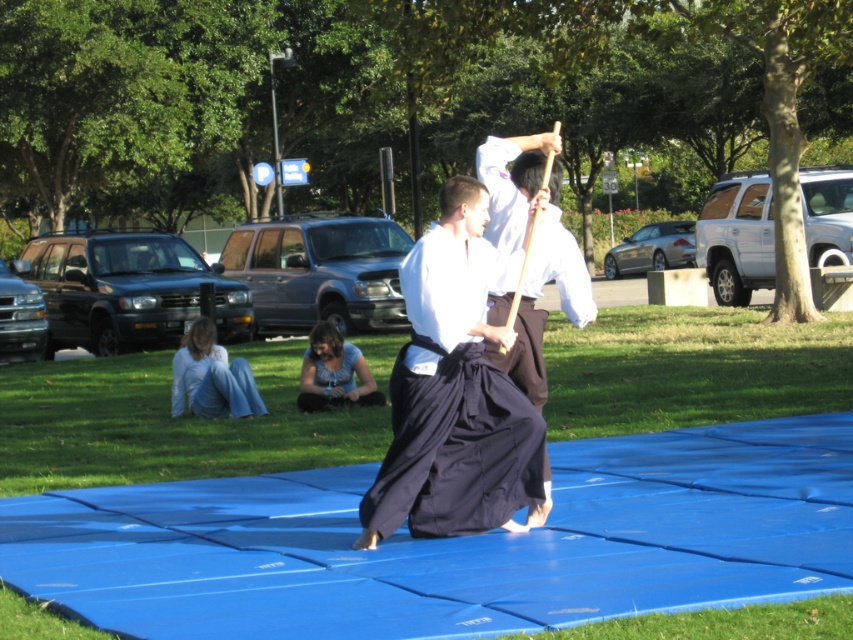
You are standing at the point with coordinates point (213, 385). Looking around, you see light blue cotton pants at lower left. What object is located exactly at your current position?

The point (213, 385) is on light blue cotton pants at lower left.

You are standing at the edge of the blue mat observing the two martial artists. There are two points marked on the mat at coordinates point (241, 356) and point (318, 333). If you were to walk directly towards the point that is closer to you, which coordinate would you be approaching?

You should walk towards point (318, 333) because it is closer to you than point (241, 356), which is further away.